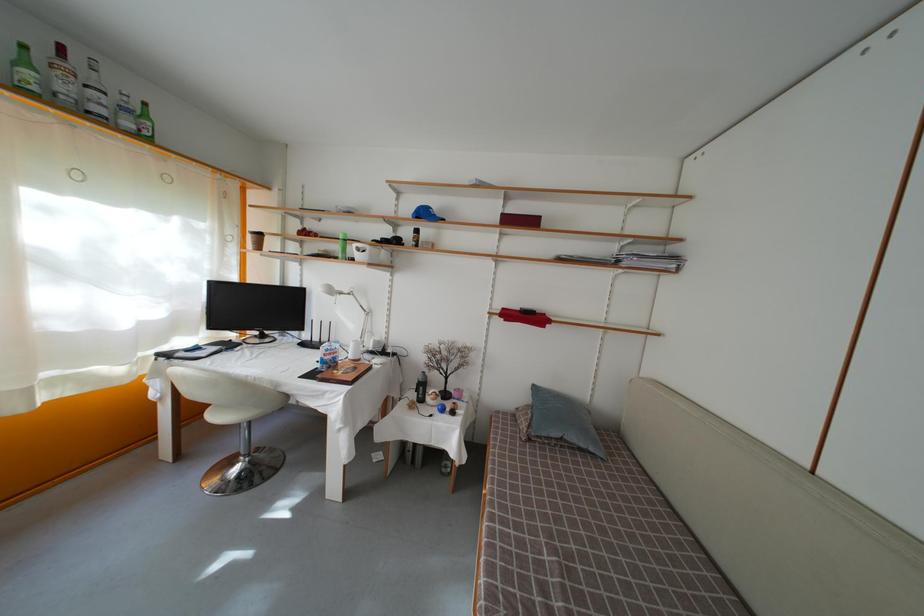
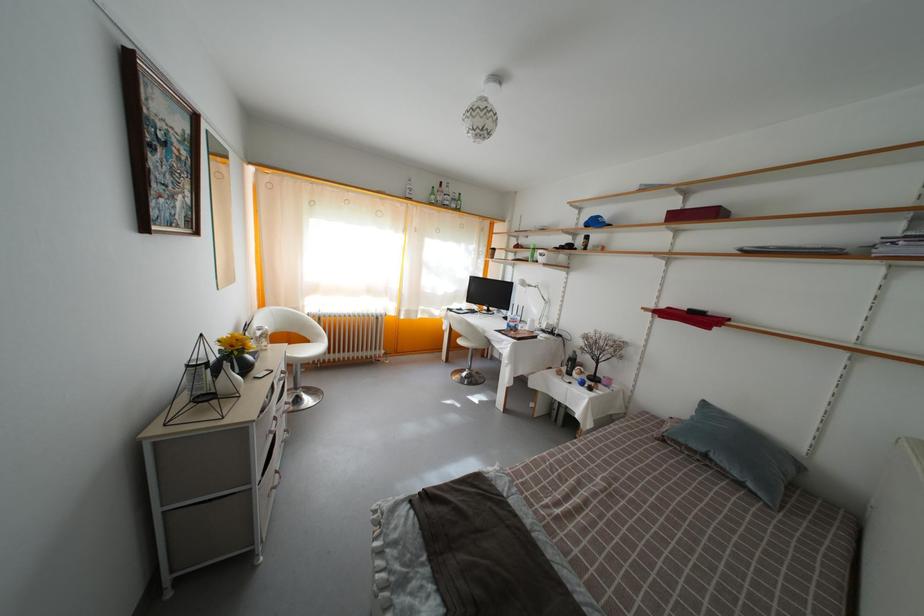
Where in the second image is the point corresponding to (x=419, y=403) from the first image?

(569, 376)